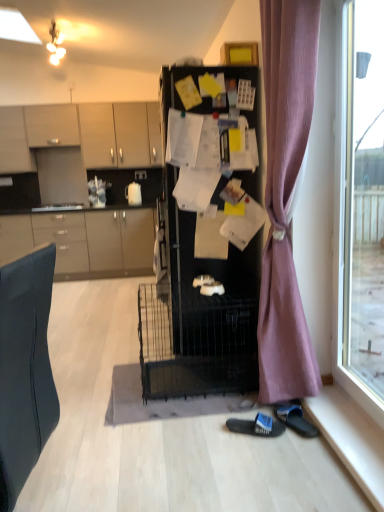
Locate an element on the screen. Image resolution: width=384 pixels, height=512 pixels. matte beige cabinet at upper left, which is the second cabinetry in bottom-to-top order is located at coordinates (14, 142).

Describe the element at coordinates (360, 200) in the screenshot. I see `transparent glass window at right` at that location.

Image resolution: width=384 pixels, height=512 pixels. Find the location of `black matte refrigerator at center`. black matte refrigerator at center is located at coordinates (201, 303).

This screenshot has width=384, height=512. What do you see at coordinates (133, 194) in the screenshot?
I see `white matte teapot at upper center` at bounding box center [133, 194].

How much space does black rubber slipper at lower right, positioned as the second footwear in left-to-right order, occupy vertically?

black rubber slipper at lower right, positioned as the second footwear in left-to-right order, is 7.28 centimeters tall.

Identify the location of matte beige cabinet at upper left, the 3th cabinetry when ordered from top to bottom. This screenshot has width=384, height=512. (14, 142).

Considering their positions, is black fabric slipper at lower center, the 2th footwear positioned from the right, located in front of or behind white matte teapot at upper center?

Visually, black fabric slipper at lower center, the 2th footwear positioned from the right, is located in front of white matte teapot at upper center.

Is black fabric slipper at lower center, acting as the 1th footwear starting from the left, situated inside white matte teapot at upper center or outside?

black fabric slipper at lower center, acting as the 1th footwear starting from the left, lies outside white matte teapot at upper center.

From the image's perspective, which object appears higher, black fabric slipper at lower center, acting as the 1th footwear starting from the left, or white matte teapot at upper center?

white matte teapot at upper center, from the image's perspective.

Can you confirm if black fabric slipper at lower center, the 2th footwear positioned from the right, is taller than white matte teapot at upper center?

In fact, black fabric slipper at lower center, the 2th footwear positioned from the right, may be shorter than white matte teapot at upper center.

How many degrees apart are the facing directions of purple fabric curtain at right and matte white cabinet at upper left, which appears as the 1th cabinetry when viewed from the top?

The facing directions of purple fabric curtain at right and matte white cabinet at upper left, which appears as the 1th cabinetry when viewed from the top, are 85.8 degrees apart.

In the scene shown: Would you say purple fabric curtain at right is to the left or to the right of matte white cabinet at upper left, the 4th cabinetry positioned from the bottom, in the picture?

purple fabric curtain at right is positioned on matte white cabinet at upper left, the 4th cabinetry positioned from the bottom,'s right side.

Is purple fabric curtain at right shorter than matte white cabinet at upper left, which appears as the 1th cabinetry when viewed from the top?

In fact, purple fabric curtain at right may be taller than matte white cabinet at upper left, which appears as the 1th cabinetry when viewed from the top.

At what (x,y) coordinates should I click in order to perform the action: click on curtain located below the matte white cabinet at upper left, which appears as the 1th cabinetry when viewed from the top (from the image's perspective). Please return your answer as a coordinate pair (x, y). Looking at the image, I should click on (285, 196).

Considering the sizes of black fabric slipper at lower center, the 2th footwear positioned from the right, and matte beige cabinet at upper left, the 3th cabinetry when ordered from top to bottom, in the image, is black fabric slipper at lower center, the 2th footwear positioned from the right, bigger or smaller than matte beige cabinet at upper left, the 3th cabinetry when ordered from top to bottom,?

Clearly, black fabric slipper at lower center, the 2th footwear positioned from the right, is smaller in size than matte beige cabinet at upper left, the 3th cabinetry when ordered from top to bottom.

In the scene shown: From a real-world perspective, who is located higher, black fabric slipper at lower center, acting as the 1th footwear starting from the left, or matte beige cabinet at upper left, which is the second cabinetry in bottom-to-top order?

In real-world perspective, matte beige cabinet at upper left, which is the second cabinetry in bottom-to-top order, is above.

Could you tell me if black fabric slipper at lower center, the 2th footwear positioned from the right, is facing matte beige cabinet at upper left, the 3th cabinetry when ordered from top to bottom?

No, black fabric slipper at lower center, the 2th footwear positioned from the right, is not turned towards matte beige cabinet at upper left, the 3th cabinetry when ordered from top to bottom.

Which object is positioned more to the left, black fabric slipper at lower center, the 2th footwear positioned from the right, or matte beige cabinet at upper left, which is the second cabinetry in bottom-to-top order?

matte beige cabinet at upper left, which is the second cabinetry in bottom-to-top order.

Is black matte refrigerator at center not within black rubber slipper at lower right, acting as the first footwear starting from the right?

Absolutely, black matte refrigerator at center is external to black rubber slipper at lower right, acting as the first footwear starting from the right.

Is black matte refrigerator at center oriented away from black rubber slipper at lower right, acting as the first footwear starting from the right?

No, black rubber slipper at lower right, acting as the first footwear starting from the right, is not at the back of black matte refrigerator at center.

Find the location of `the 2nd footwear to the right when counting from the black matte refrigerator at center`. the 2nd footwear to the right when counting from the black matte refrigerator at center is located at coordinates (295, 419).

Is black matte refrigerator at center further to camera compared to black rubber slipper at lower right, positioned as the second footwear in left-to-right order?

Yes, it is.

Is transparent glass window at right looking in the opposite direction of matte beige cabinets at upper left, which appears as the 3th cabinetry when ordered from the bottom?

That's not correct — transparent glass window at right is not looking away from matte beige cabinets at upper left, which appears as the 3th cabinetry when ordered from the bottom.

Is transparent glass window at right bigger or smaller than matte beige cabinets at upper left, positioned as the 2th cabinetry in top-to-bottom order?

Clearly, transparent glass window at right is smaller in size than matte beige cabinets at upper left, positioned as the 2th cabinetry in top-to-bottom order.

Can you confirm if transparent glass window at right is thinner than matte beige cabinets at upper left, positioned as the 2th cabinetry in top-to-bottom order?

Yes, transparent glass window at right is thinner than matte beige cabinets at upper left, positioned as the 2th cabinetry in top-to-bottom order.

What's the angular difference between transparent glass window at right and matte beige cabinets at upper left, positioned as the 2th cabinetry in top-to-bottom order,'s facing directions?

The facing directions of transparent glass window at right and matte beige cabinets at upper left, positioned as the 2th cabinetry in top-to-bottom order, are 89.5 degrees apart.

In the image, there is a black fabric slipper at lower center, acting as the 1th footwear starting from the left. Identify the location of curtain above it (from the image's perspective). (285, 196).

From the image's perspective, is purple fabric curtain at right positioned above or below black fabric slipper at lower center, the 2th footwear positioned from the right?

purple fabric curtain at right is situated higher than black fabric slipper at lower center, the 2th footwear positioned from the right, in the image.

Is black fabric slipper at lower center, acting as the 1th footwear starting from the left, located within purple fabric curtain at right?

No, black fabric slipper at lower center, acting as the 1th footwear starting from the left, is not surrounded by purple fabric curtain at right.

Does purple fabric curtain at right have a greater height compared to black fabric slipper at lower center, the 2th footwear positioned from the right?

Correct, purple fabric curtain at right is much taller as black fabric slipper at lower center, the 2th footwear positioned from the right.

Is point (75, 208) positioned in front of point (110, 217)?

Yes, it is.

From a real-world perspective, is white glossy sink at left positioned above or below matte gray cabinets at left, positioned as the 4th cabinetry in top-to-bottom order?

From a real-world perspective, white glossy sink at left is physically above matte gray cabinets at left, positioned as the 4th cabinetry in top-to-bottom order.

What's the angular difference between white glossy sink at left and matte gray cabinets at left, positioned as the 4th cabinetry in top-to-bottom order,'s facing directions?

The angular difference between white glossy sink at left and matte gray cabinets at left, positioned as the 4th cabinetry in top-to-bottom order, is 0.532 degrees.

Considering the relative sizes of white glossy sink at left and matte gray cabinets at left, acting as the 1th cabinetry starting from the bottom, in the image provided, is white glossy sink at left bigger than matte gray cabinets at left, acting as the 1th cabinetry starting from the bottom,?

Actually, white glossy sink at left might be smaller than matte gray cabinets at left, acting as the 1th cabinetry starting from the bottom.

In the image, there is a black fabric slipper at lower center, the 2th footwear positioned from the right. At what (x,y) coordinates should I click in order to perform the action: click on teapot above it (from the image's perspective). Please return your answer as a coordinate pair (x, y). The image size is (384, 512). Looking at the image, I should click on (133, 194).

You are a GUI agent. You are given a task and a screenshot of the screen. Output one action in this format:
    pyautogui.click(x=<x>, y=<y>)
    Task: Click on the cabinetry that is the 3rd one when counting leftward from the purple fabric curtain at right
    The height and width of the screenshot is (512, 384).
    Given the screenshot: What is the action you would take?
    pyautogui.click(x=52, y=125)

When comparing their distances from white matte teapot at upper center, does transparent glass window at right or black rubber slipper at lower right, positioned as the second footwear in left-to-right order, seem further?

Based on the image, black rubber slipper at lower right, positioned as the second footwear in left-to-right order, appears to be further to white matte teapot at upper center.

Considering their positions, is matte gray cabinets at left, positioned as the 4th cabinetry in top-to-bottom order, positioned further to matte beige cabinet at upper left, which is the second cabinetry in bottom-to-top order, than black rubber slipper at lower right, acting as the first footwear starting from the right?

black rubber slipper at lower right, acting as the first footwear starting from the right.

Looking at the image, which one is located further to purple fabric curtain at right, black fabric slipper at lower center, acting as the 1th footwear starting from the left, or matte gray cabinets at left, positioned as the 4th cabinetry in top-to-bottom order?

matte gray cabinets at left, positioned as the 4th cabinetry in top-to-bottom order, is positioned further to the anchor purple fabric curtain at right.

Which object lies nearer to the anchor point black matte refrigerator at center, matte beige cabinets at upper left, positioned as the 2th cabinetry in top-to-bottom order, or matte white cabinet at upper left, the 4th cabinetry positioned from the bottom?

matte beige cabinets at upper left, positioned as the 2th cabinetry in top-to-bottom order, is positioned closer to the anchor black matte refrigerator at center.

Which object lies further to the anchor point matte beige cabinet at upper left, the 3th cabinetry when ordered from top to bottom, matte gray cabinets at left, acting as the 1th cabinetry starting from the bottom, or black fabric slipper at lower center, acting as the 1th footwear starting from the left?

black fabric slipper at lower center, acting as the 1th footwear starting from the left, is positioned further to the anchor matte beige cabinet at upper left, the 3th cabinetry when ordered from top to bottom.

Based on their spatial positions, is matte beige cabinet at upper left, the 3th cabinetry when ordered from top to bottom, or black rubber slipper at lower right, acting as the first footwear starting from the right, further from black matte refrigerator at center?

matte beige cabinet at upper left, the 3th cabinetry when ordered from top to bottom, is positioned further to the anchor black matte refrigerator at center.

Based on their spatial positions, is purple fabric curtain at right or white glossy sink at left closer to matte white cabinet at upper left, which appears as the 1th cabinetry when viewed from the top?

white glossy sink at left is closer to matte white cabinet at upper left, which appears as the 1th cabinetry when viewed from the top.

Estimate the real-world distances between objects in this image. Which object is closer to purple fabric curtain at right, white matte teapot at upper center or matte gray cabinets at left, acting as the 1th cabinetry starting from the bottom?

matte gray cabinets at left, acting as the 1th cabinetry starting from the bottom, lies closer to purple fabric curtain at right than the other object.

Find the location of `curtain between black matte refrigerator at center and black rubber slipper at lower right, positioned as the second footwear in left-to-right order, from top to bottom`. curtain between black matte refrigerator at center and black rubber slipper at lower right, positioned as the second footwear in left-to-right order, from top to bottom is located at coordinates (285, 196).

Find the location of a particular element. curtain located between transparent glass window at right and white glossy sink at left in the depth direction is located at coordinates (285, 196).

You are a GUI agent. You are given a task and a screenshot of the screen. Output one action in this format:
    pyautogui.click(x=<x>, y=<y>)
    Task: Click on the sink between matte beige cabinet at upper left, which is the second cabinetry in bottom-to-top order, and white matte teapot at upper center from left to right
    The width and height of the screenshot is (384, 512).
    Given the screenshot: What is the action you would take?
    pyautogui.click(x=58, y=207)

What are the coordinates of `sink between black matte refrigerator at center and white matte teapot at upper center along the z-axis` in the screenshot? It's located at (58, 207).